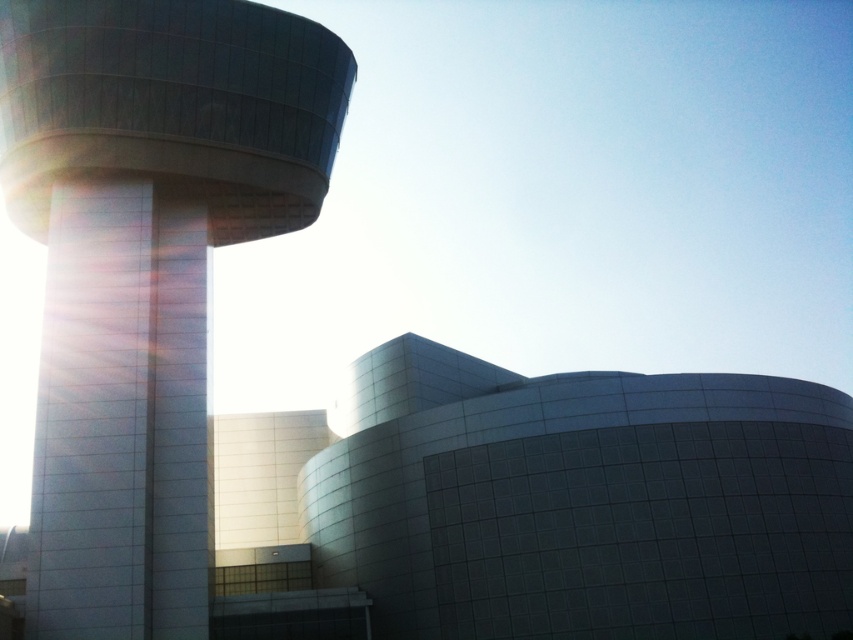
Question: Among these points, which one is farthest from the camera?

Choices:
 (A) (80, 592)
 (B) (254, 56)

Answer: (B)

Question: Does smooth glass tower at left have a lesser width compared to white glossy pillar at left?

Choices:
 (A) no
 (B) yes

Answer: (A)

Question: Is smooth glass tower at left positioned at the back of white glossy pillar at left?

Choices:
 (A) yes
 (B) no

Answer: (A)

Question: Which point is farther from the camera taking this photo?

Choices:
 (A) (59, 616)
 (B) (332, 161)

Answer: (B)

Question: Considering the relative positions of smooth glass tower at left and white glossy pillar at left in the image provided, where is smooth glass tower at left located with respect to white glossy pillar at left?

Choices:
 (A) below
 (B) above

Answer: (B)